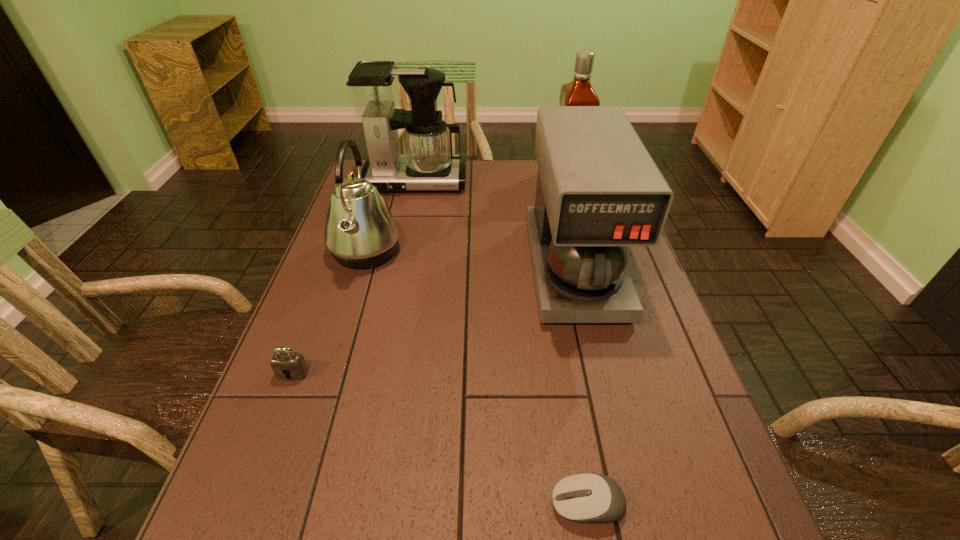
The image size is (960, 540). I want to click on free space located on the front label of the liquor, so click(x=493, y=179).

At what (x,y) coordinates should I click in order to perform the action: click on blank space located at the front of the left coffee maker where the controls are located. Please return your answer as a coordinate pair (x, y). Looking at the image, I should click on (409, 211).

Where is `vacant space situated 0.200m on the carafe side of the right coffee maker`? The height and width of the screenshot is (540, 960). vacant space situated 0.200m on the carafe side of the right coffee maker is located at coordinates (608, 406).

What are the coordinates of `vacant space located from the spout of the kettle` in the screenshot? It's located at (498, 252).

Where is `free spot located 0.120m at the front of the padlock near the keyhole`? This screenshot has height=540, width=960. free spot located 0.120m at the front of the padlock near the keyhole is located at coordinates (269, 437).

Find the location of `vacant space situated on the wheel side of the shortest object`. vacant space situated on the wheel side of the shortest object is located at coordinates (384, 504).

This screenshot has width=960, height=540. Find the location of `free space located on the wheel side of the shortest object`. free space located on the wheel side of the shortest object is located at coordinates (348, 504).

Locate an element on the screen. Image resolution: width=960 pixels, height=540 pixels. vacant space located on the wheel side of the shortest object is located at coordinates (484, 504).

Identify the location of liquor at the far edge. (579, 92).

This screenshot has height=540, width=960. What are the coordinates of `coffee maker situated at the far edge` in the screenshot? It's located at (428, 164).